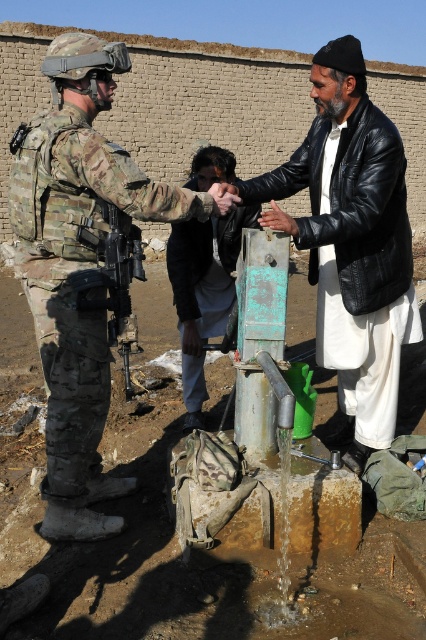
Question: Is black leather jacket at right to the right of dark brown leather jacket at center from the viewer's perspective?

Choices:
 (A) yes
 (B) no

Answer: (A)

Question: Estimate the real-world distances between objects in this image. Which object is farther from the camouflage fabric uniform at left?

Choices:
 (A) camouflage fabric rifle at center
 (B) black leather jacket at right

Answer: (B)

Question: Observing the image, what is the correct spatial positioning of black leather jacket at right in reference to dark brown leather jacket at center?

Choices:
 (A) below
 (B) above

Answer: (B)

Question: Can you confirm if black leather jacket at right is bigger than dark brown leather jacket at center?

Choices:
 (A) no
 (B) yes

Answer: (B)

Question: Which point is closer to the camera?

Choices:
 (A) dark brown leather jacket at center
 (B) camouflage fabric uniform at left

Answer: (B)

Question: Which object is the closest to the black leather jacket at right?

Choices:
 (A) camouflage fabric uniform at left
 (B) camouflage fabric rifle at center
 (C) dark brown leather jacket at center

Answer: (C)